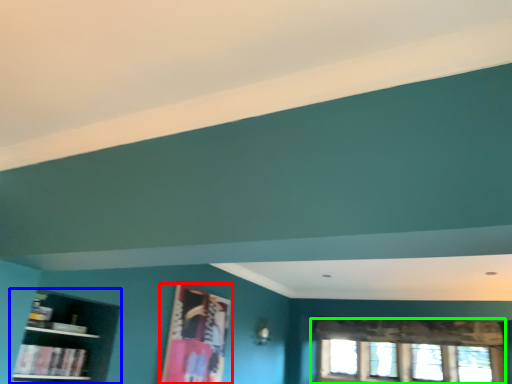
Question: Estimate the real-world distances between objects in this image. Which object is closer to picture frame (highlighted by a red box), shelf (highlighted by a blue box) or window (highlighted by a green box)?

Choices:
 (A) shelf
 (B) window

Answer: (A)